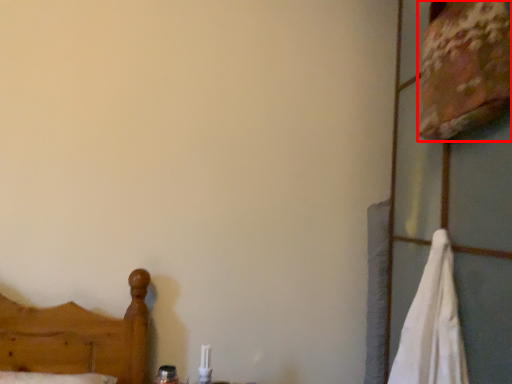
Question: In this image, where is sheet (annotated by the red box) located relative to bath towel?

Choices:
 (A) left
 (B) right

Answer: (B)